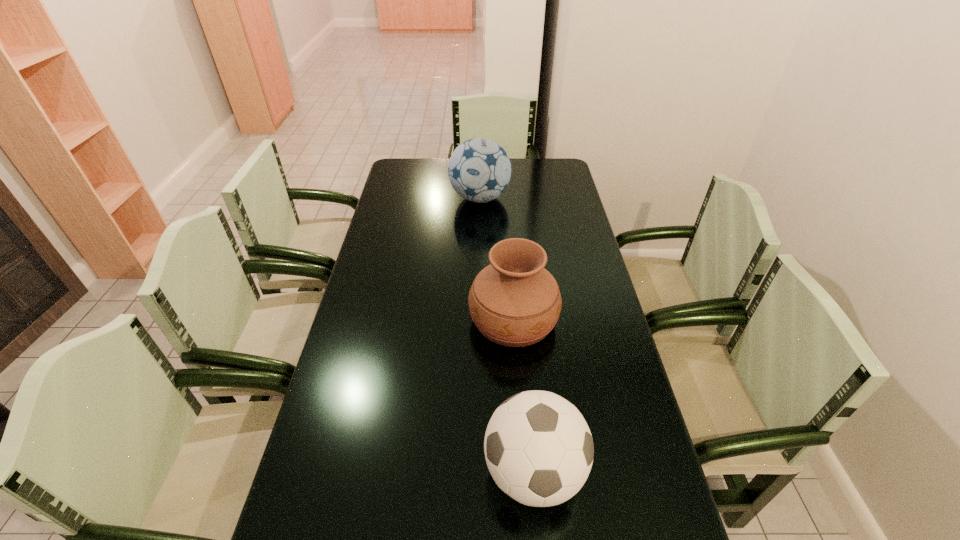
The image size is (960, 540). I want to click on the farther soccer ball, so click(479, 170).

This screenshot has width=960, height=540. What are the coordinates of `the second farthest object` in the screenshot? It's located at (515, 302).

Find the location of a particular element. the nearer soccer ball is located at coordinates (539, 450).

What are the coordinates of `free space located 0.080m on the side with brand of the farthest object` in the screenshot? It's located at (480, 227).

Where is `vacant space located 0.170m on the front of the urn`? The height and width of the screenshot is (540, 960). vacant space located 0.170m on the front of the urn is located at coordinates (520, 410).

The height and width of the screenshot is (540, 960). In order to click on vacant position located on the left of the nearest object in this screenshot , I will do `click(407, 471)`.

At what (x,y) coordinates should I click in order to perform the action: click on object present at the far edge. Please return your answer as a coordinate pair (x, y). Looking at the image, I should click on (479, 170).

Identify the location of object that is at the right edge. (515, 302).

At what (x,y) coordinates should I click in order to perform the action: click on vacant region at the far edge. Please return your answer as a coordinate pair (x, y). The width and height of the screenshot is (960, 540). Looking at the image, I should click on (522, 166).

Where is `free point at the left edge`? The width and height of the screenshot is (960, 540). free point at the left edge is located at coordinates [x=406, y=199].